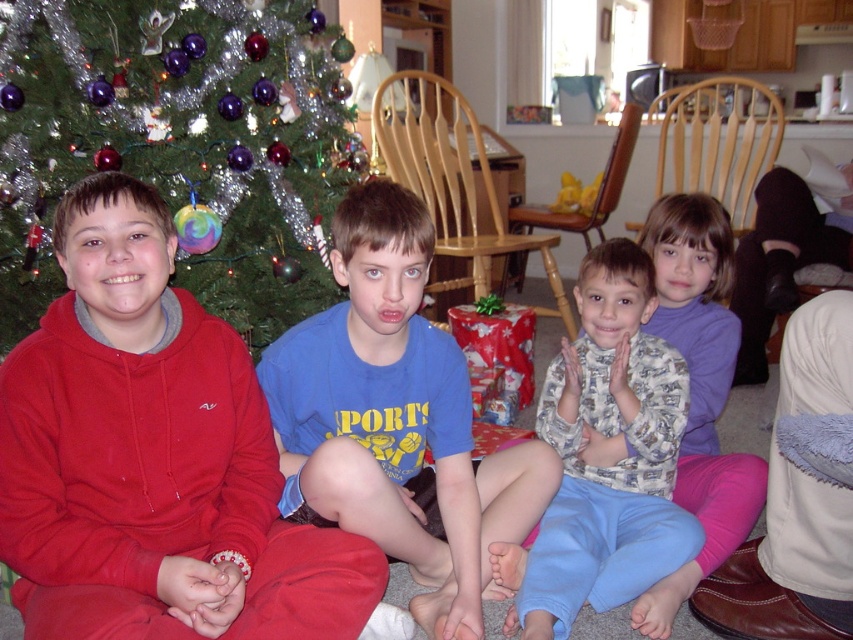
You are a parent trying to seat two children on a narrow bench that can only accommodate one child at a time. The printed cotton shirt at center and the purple fleece shirt at center are both present. Which child should you choose to sit first to ensure they fit comfortably?

The printed cotton shirt at center might be wider than purple fleece shirt at center, so it would be better to seat the purple fleece shirt at center first to ensure they fit comfortably on the narrow bench.

You are a photographer positioned at the origin point of the scene. You want to take a photo of the blue cotton shirt at center. What are the coordinates where you should aim your camera?

The blue cotton shirt at center is located at coordinates point (396, 419), so you should aim your camera at those coordinates to capture it.